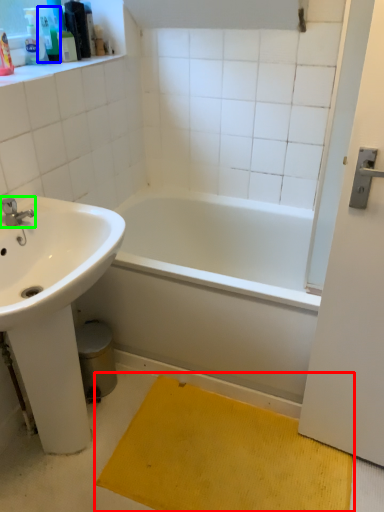
Question: Which object is the farthest from doormat (highlighted by a red box)? Choose among these: toiletry (highlighted by a blue box) or tap (highlighted by a green box).

Choices:
 (A) toiletry
 (B) tap

Answer: (A)